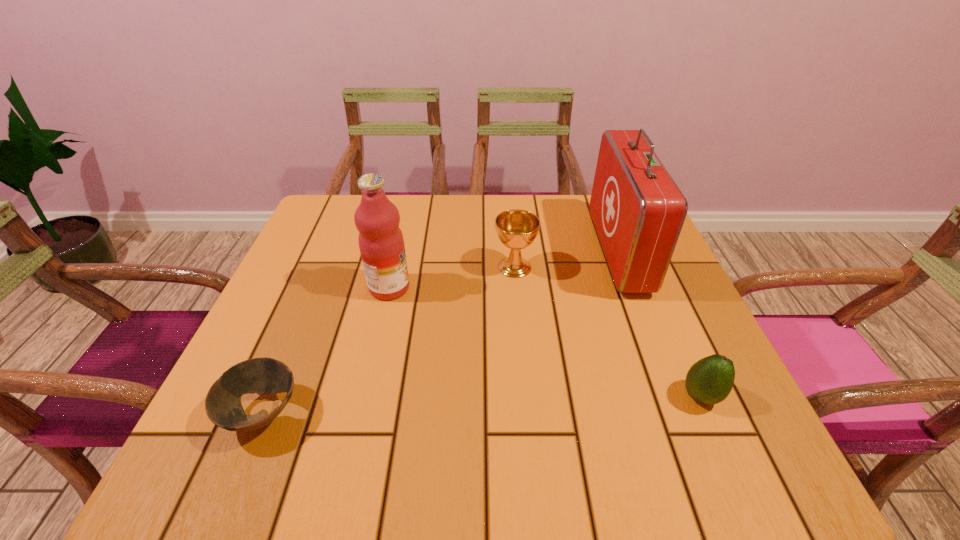
At what (x,y) coordinates should I click in order to perform the action: click on free space located on the label of the second object from left to right. Please return your answer as a coordinate pair (x, y). Looking at the image, I should click on (524, 288).

Find the location of a particular element. This screenshot has width=960, height=540. vacant space located on the left of the third tallest object is located at coordinates (326, 267).

I want to click on free space located 0.270m on the back of the avocado, so [x=651, y=282].

Identify the location of vacant region located on the back of the bowl. (291, 347).

You are a GUI agent. You are given a task and a screenshot of the screen. Output one action in this format:
    pyautogui.click(x=<x>, y=<y>)
    Task: Click on the object located at the far edge
    This screenshot has width=960, height=540.
    Given the screenshot: What is the action you would take?
    pyautogui.click(x=638, y=211)

At what (x,y) coordinates should I click in order to perform the action: click on object that is at the near edge. Please return your answer as a coordinate pair (x, y). The width and height of the screenshot is (960, 540). Looking at the image, I should click on (223, 406).

Where is `object located at the left edge`? object located at the left edge is located at coordinates (223, 406).

The width and height of the screenshot is (960, 540). Identify the location of the first-aid kit that is at the right edge. (638, 211).

Find the location of a particular element. The height and width of the screenshot is (540, 960). avocado present at the right edge is located at coordinates (709, 381).

Locate an element on the screen. The height and width of the screenshot is (540, 960). object that is at the near left corner is located at coordinates (223, 406).